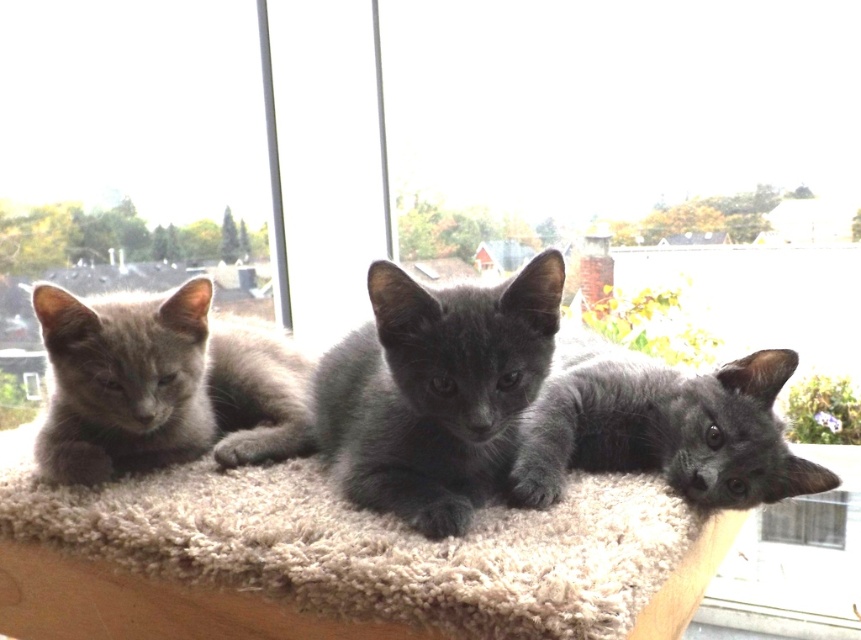
Who is higher up, gray fluffy kitten at left or transparent glass window at lower right?

gray fluffy kitten at left is higher up.

Who is shorter, gray fluffy kitten at left or transparent glass window at lower right?

gray fluffy kitten at left

Image resolution: width=861 pixels, height=640 pixels. What are the coordinates of `gray fluffy kitten at left` in the screenshot? It's located at (162, 385).

The width and height of the screenshot is (861, 640). I want to click on gray fluffy kitten at left, so click(x=162, y=385).

How far apart are soft beige carpet at center and gray fluffy kitten at left?

A distance of 6.26 inches exists between soft beige carpet at center and gray fluffy kitten at left.

Which is above, soft beige carpet at center or gray fluffy kitten at left?

gray fluffy kitten at left is above.

Is point (469, 556) more distant than point (191, 381)?

No.

The height and width of the screenshot is (640, 861). In order to click on soft beige carpet at center in this screenshot , I will do `click(369, 545)`.

Which is below, soft beige carpet at center or shiny black kitten at center?

soft beige carpet at center is lower down.

Can you confirm if soft beige carpet at center is positioned to the left of shiny black kitten at center?

Correct, you'll find soft beige carpet at center to the left of shiny black kitten at center.

Describe the element at coordinates (369, 545) in the screenshot. I see `soft beige carpet at center` at that location.

Where is `soft beige carpet at center`? The image size is (861, 640). soft beige carpet at center is located at coordinates pyautogui.click(x=369, y=545).